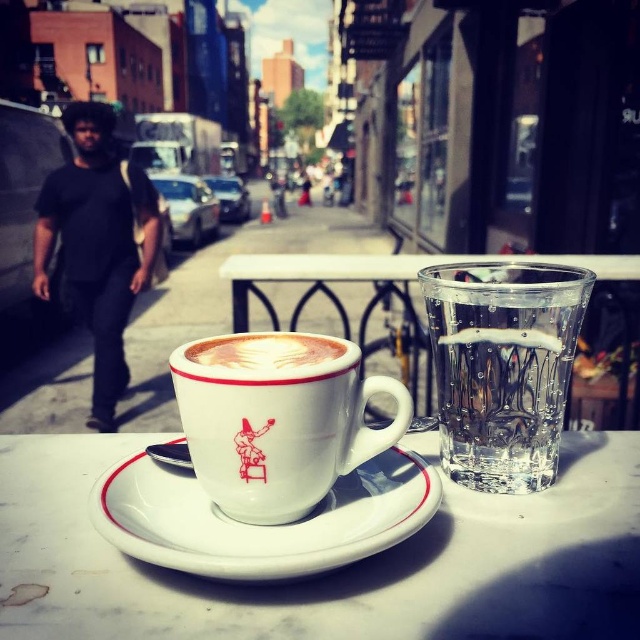
Question: Which object appears farthest from the camera in this image?

Choices:
 (A) white glossy table at center
 (B) white marble table at center
 (C) white ceramic saucer at center

Answer: (A)

Question: Can you confirm if black cotton shirt at left is bigger than white glossy table at center?

Choices:
 (A) yes
 (B) no

Answer: (B)

Question: Which object appears closest to the camera in this image?

Choices:
 (A) black cotton shirt at left
 (B) white ceramic saucer at center

Answer: (B)

Question: Which point is farther to the camera?

Choices:
 (A) clear glass water at upper right
 (B) black cotton shirt at left
 (C) white ceramic mug at center

Answer: (B)

Question: Is white marble table at center below white ceramic saucer at center?

Choices:
 (A) yes
 (B) no

Answer: (A)

Question: Can you confirm if white marble table at center is positioned below clear glass water at upper right?

Choices:
 (A) yes
 (B) no

Answer: (A)